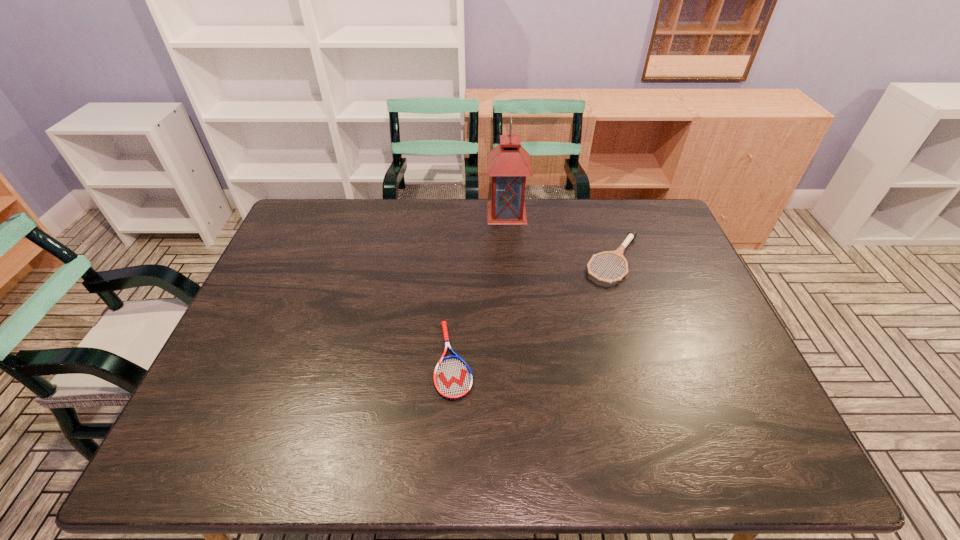
Find the location of a particular element. tennis racket situated at the far edge is located at coordinates (632, 234).

The image size is (960, 540). I want to click on object that is at the right edge, so [632, 234].

Identify the location of object present at the far right corner. (632, 234).

I want to click on vacant space at the far edge of the desktop, so click(x=613, y=219).

In the image, there is a desktop. At what (x,y) coordinates should I click in order to perform the action: click on free space at the near edge. Please return your answer as a coordinate pair (x, y). Image resolution: width=960 pixels, height=540 pixels. Looking at the image, I should click on (619, 448).

Find the location of a particular element. vacant space at the left edge of the desktop is located at coordinates (299, 316).

Where is `vacant space at the right edge of the desktop`? The height and width of the screenshot is (540, 960). vacant space at the right edge of the desktop is located at coordinates point(669,298).

Image resolution: width=960 pixels, height=540 pixels. I want to click on blank space at the far left corner of the desktop, so click(x=323, y=213).

In the image, there is a desktop. Where is `free space at the far right corner`? The height and width of the screenshot is (540, 960). free space at the far right corner is located at coordinates (629, 213).

Locate an element on the screen. The image size is (960, 540). unoccupied area between the nearer tennis racket and the lantern is located at coordinates (480, 286).